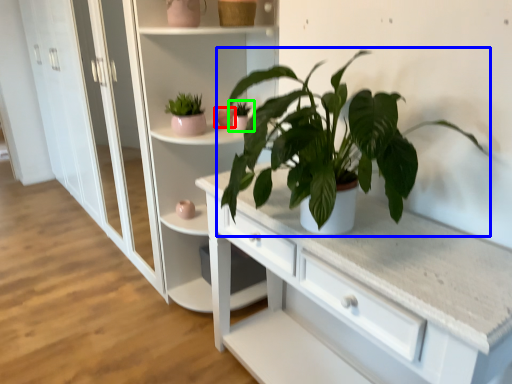
Question: Considering the real-world distances, which object is farthest from flowerpot (highlighted by a red box)? houseplant (highlighted by a blue box) or houseplant (highlighted by a green box)?

Choices:
 (A) houseplant
 (B) houseplant

Answer: (A)